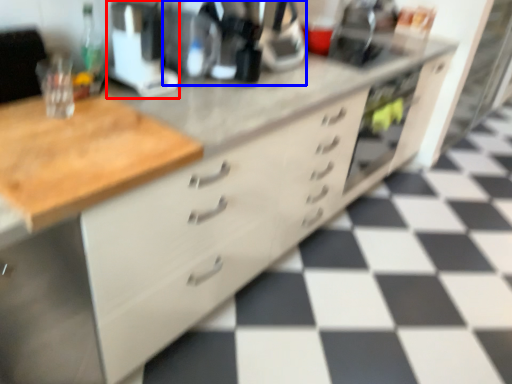
Question: Which of the following is the closest to the observer, appliance (highlighted by a red box) or coffee machine (highlighted by a blue box)?

Choices:
 (A) appliance
 (B) coffee machine

Answer: (A)